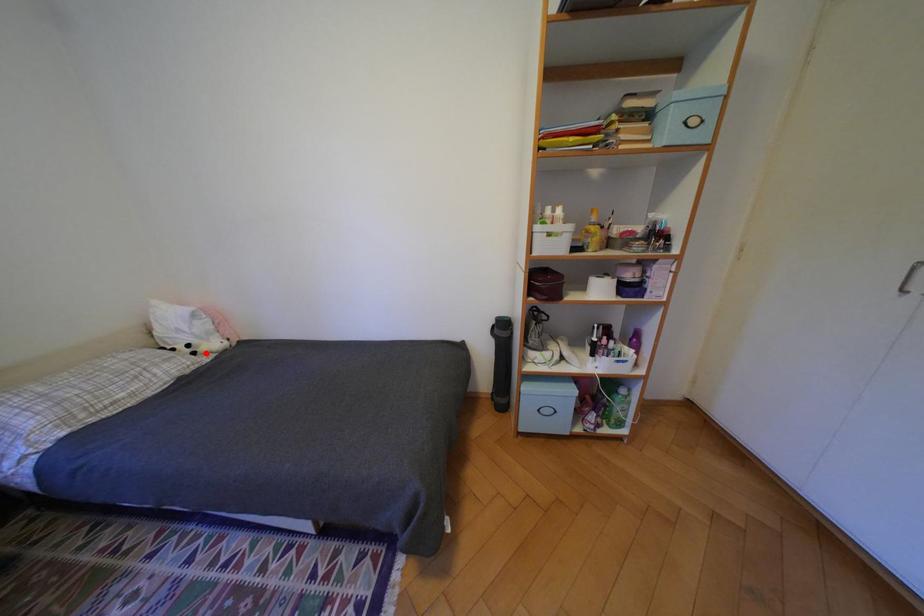
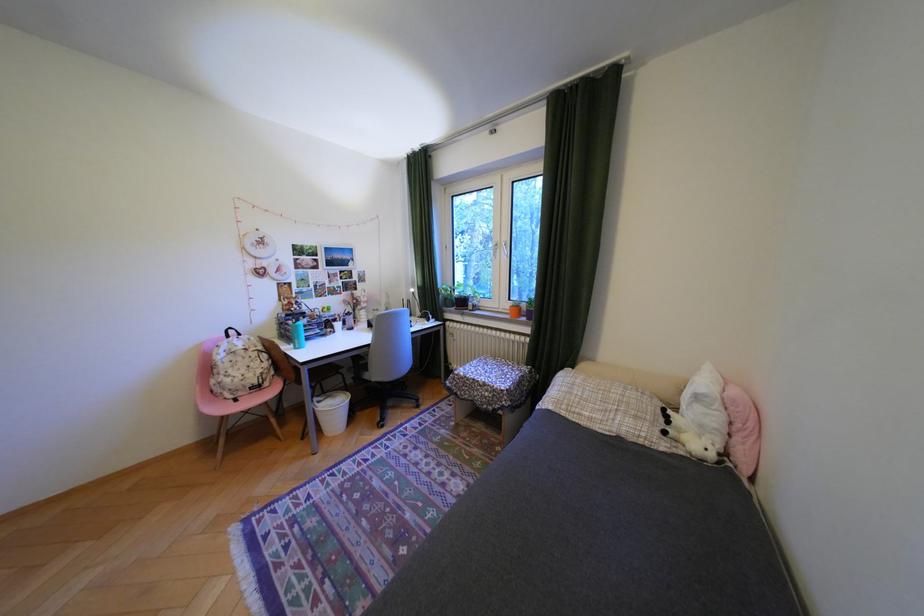
Question: I am providing you with two images of the same scene from different viewpoints. A red point is shown in image1. For the corresponding object point in image2, is it positioned nearer or farther from the camera?

Choices:
 (A) Nearer
 (B) Farther

Answer: (B)